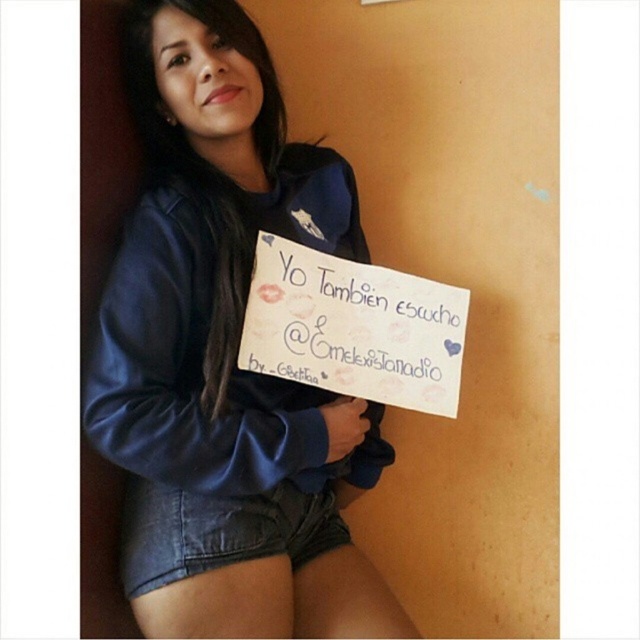
Question: Is blue fleece sweatshirt at upper left smaller than denim shorts at lower center?

Choices:
 (A) no
 (B) yes

Answer: (A)

Question: Considering the relative positions of blue fleece sweatshirt at upper left and denim shorts at lower center in the image provided, where is blue fleece sweatshirt at upper left located with respect to denim shorts at lower center?

Choices:
 (A) right
 (B) left

Answer: (A)

Question: Which object is the farthest from the white paper at center?

Choices:
 (A) denim shorts at lower center
 (B) blue fleece sweatshirt at upper left

Answer: (A)

Question: Which object appears closest to the camera in this image?

Choices:
 (A) denim shorts at lower center
 (B) white paper at center
 (C) blue fleece sweatshirt at upper left

Answer: (C)

Question: Can you confirm if white paper at center is thinner than denim shorts at lower center?

Choices:
 (A) yes
 (B) no

Answer: (B)

Question: Considering the real-world distances, which object is closest to the denim shorts at lower center?

Choices:
 (A) blue fleece sweatshirt at upper left
 (B) white paper at center

Answer: (A)